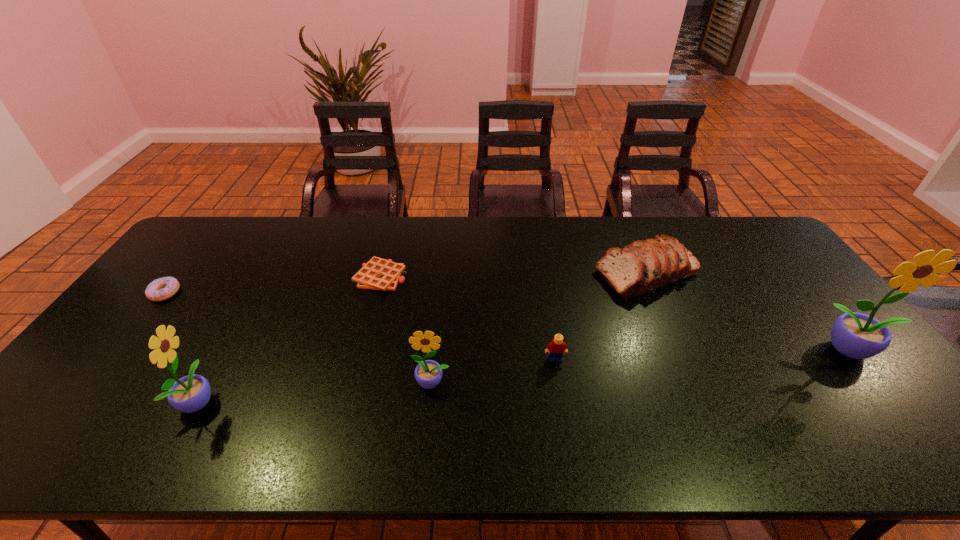
What are the coordinates of `object at the left edge` in the screenshot? It's located at (160, 289).

Where is `object located at the right edge`? The image size is (960, 540). object located at the right edge is located at coordinates (855, 335).

This screenshot has height=540, width=960. What are the coordinates of `vacant space at the far edge` in the screenshot? It's located at (569, 225).

Locate an element on the screen. vacant space at the near edge of the desktop is located at coordinates (556, 410).

This screenshot has width=960, height=540. In order to click on vacant space at the right edge of the desktop in this screenshot , I will do `click(814, 312)`.

Where is `free space at the far left corner of the desktop`? The width and height of the screenshot is (960, 540). free space at the far left corner of the desktop is located at coordinates (217, 225).

Identify the location of free space at the near left corner of the desktop. The width and height of the screenshot is (960, 540). (74, 385).

Locate an element on the screen. The image size is (960, 540). vacant space at the far right corner is located at coordinates (751, 228).

At what (x,y) coordinates should I click in order to perform the action: click on free area in between the sixth shortest object and the waffle. Please return your answer as a coordinate pair (x, y). The height and width of the screenshot is (540, 960). Looking at the image, I should click on (290, 339).

I want to click on vacant region between the second shortest sunflower and the rightmost object, so click(525, 375).